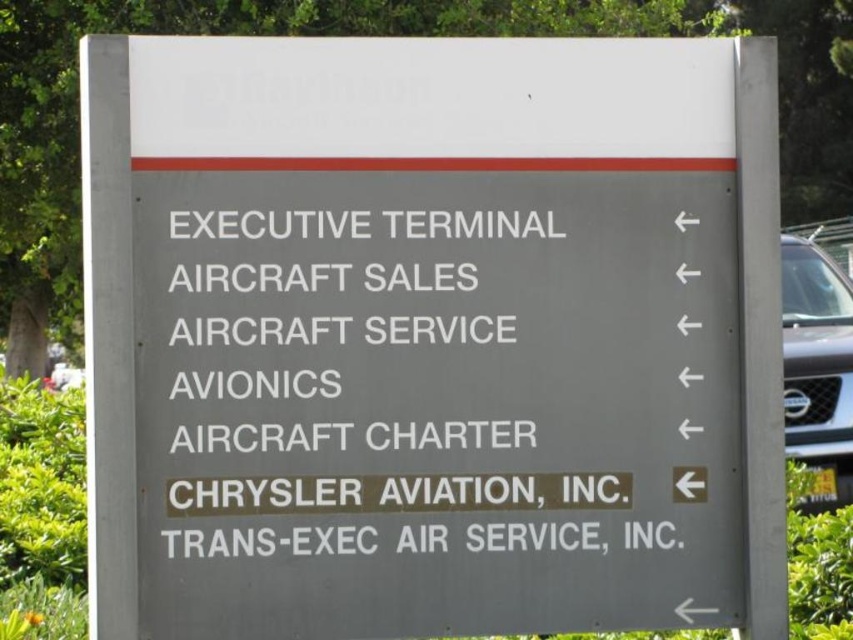
You are looking at the directional signboard and need to find the location of the white text on gray sign at center. According to the sign, what are the coordinates where this text is placed?

The white text on gray sign at center is located at point (402,388).

You are a traveler at the airport and want to read the services listed on the white text on gray sign at center. However, there is a satin silver suv at right parked nearby. Which object is easier to see from a distance?

The satin silver suv at right is larger in size compared to the white text on gray sign at center, so it is easier to see from a distance.